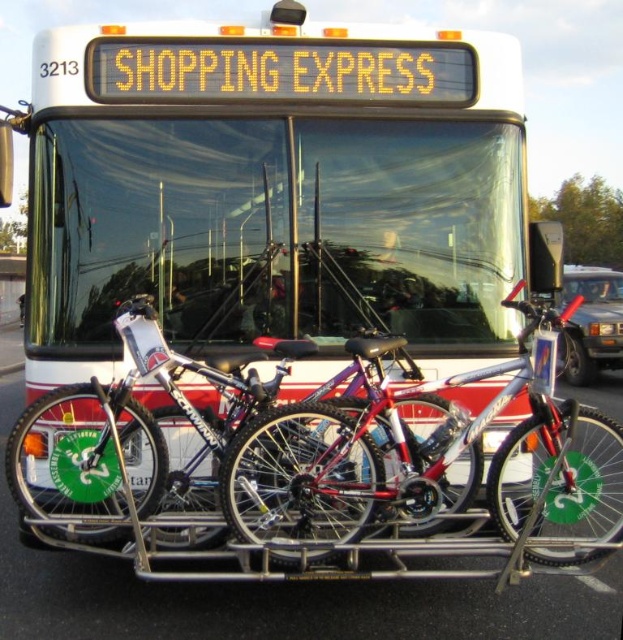
Which is more to the left, white matte bus at center or shiny silver bicycle at center?

white matte bus at center is more to the left.

How much distance is there between white matte bus at center and shiny silver bicycle at center?

The distance of white matte bus at center from shiny silver bicycle at center is 18.87 inches.

Identify the location of white matte bus at center. (272, 192).

Where is `white matte bus at center`? white matte bus at center is located at coordinates (272, 192).

Between shiny metallic bicycle at center and shiny silver bicycle at center, which one is positioned lower?

Positioned lower is shiny metallic bicycle at center.

Is shiny metallic bicycle at center closer to camera compared to shiny silver bicycle at center?

That is True.

The image size is (623, 640). In order to click on shiny metallic bicycle at center in this screenshot , I will do `click(424, 461)`.

This screenshot has width=623, height=640. Describe the element at coordinates (272, 192) in the screenshot. I see `white matte bus at center` at that location.

Between point (368, 252) and point (391, 342), which one is positioned in front?

Positioned in front is point (391, 342).

Find the location of a particular element. This screenshot has height=640, width=623. white matte bus at center is located at coordinates (272, 192).

This screenshot has width=623, height=640. In order to click on white matte bus at center in this screenshot , I will do `click(272, 192)`.